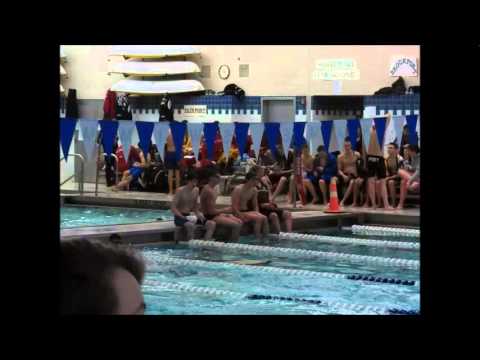
The image size is (480, 360). What are the coordinates of `clock` in the screenshot? It's located at point(222,69).